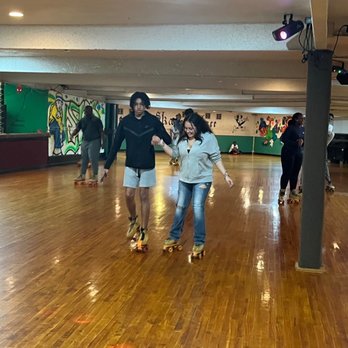
Where is `column`? This screenshot has width=348, height=348. column is located at coordinates (312, 172).